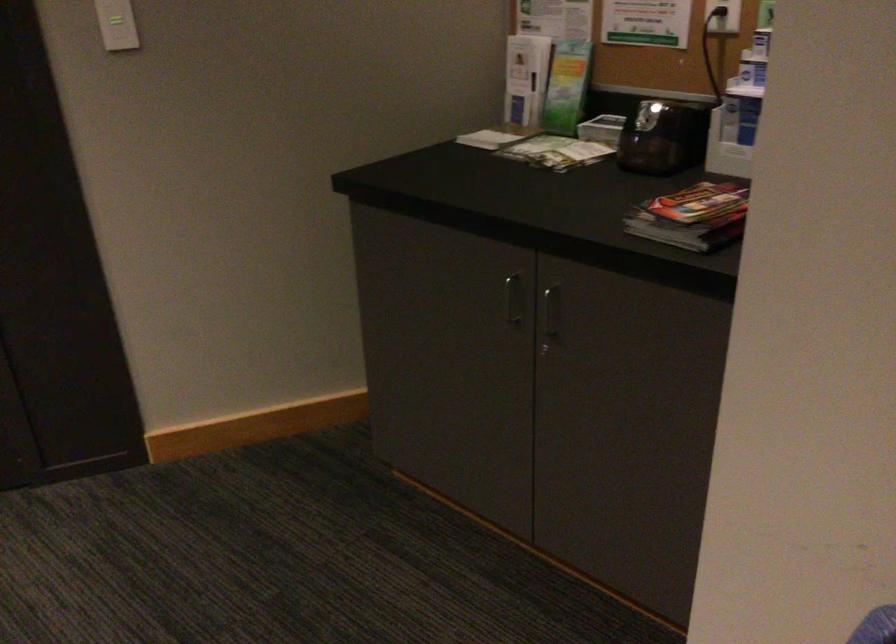
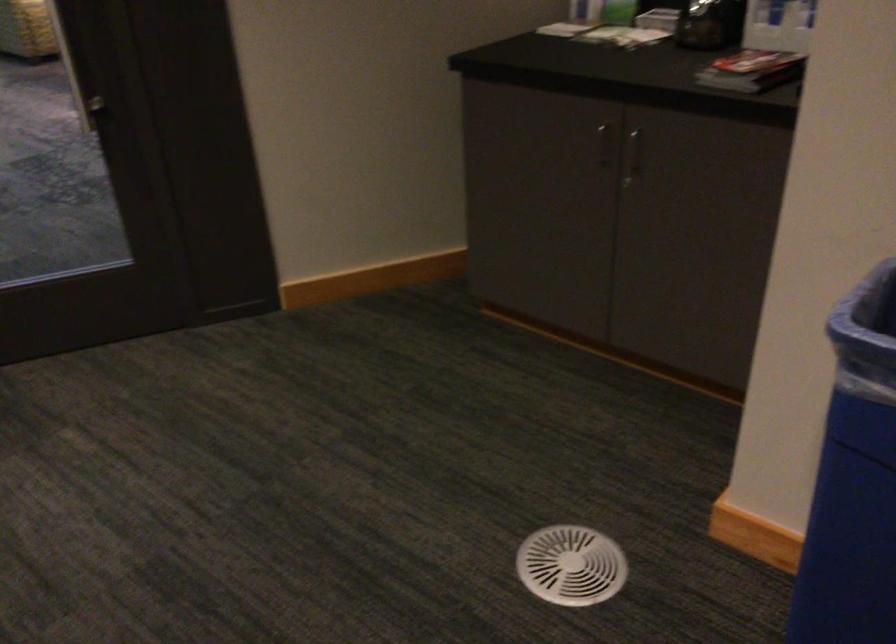
In a continuous first-person perspective shot, in which direction is the camera moving?

The movement direction of the cameraman is left, backward.